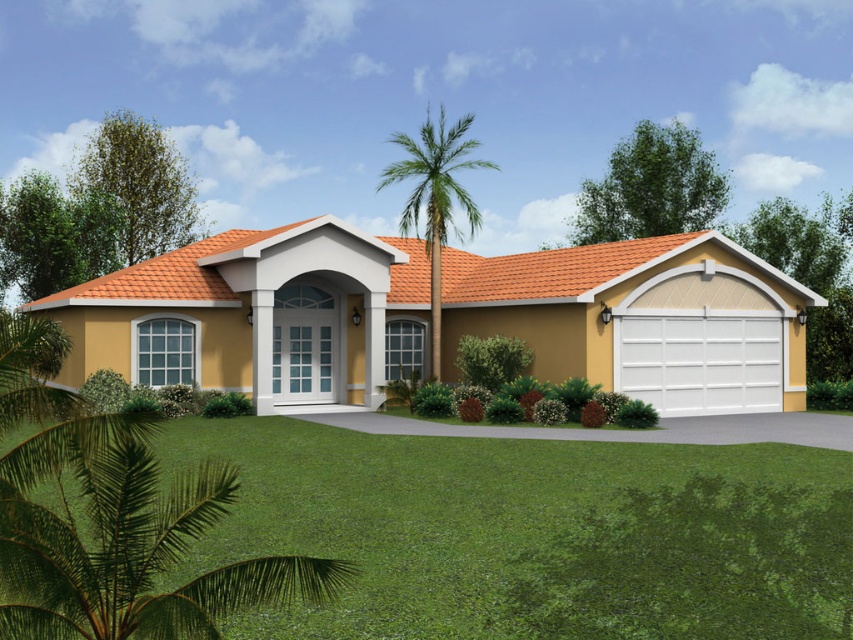
You are planning to install a new garden path between the green grass at lower center and the white textured garage door at lower right. Considering their widths, which area should the path be placed closer to for better visibility?

The path should be placed closer to the white textured garage door at lower right because the green grass at lower center is wider, allowing more space for the path near the narrower garage door area.